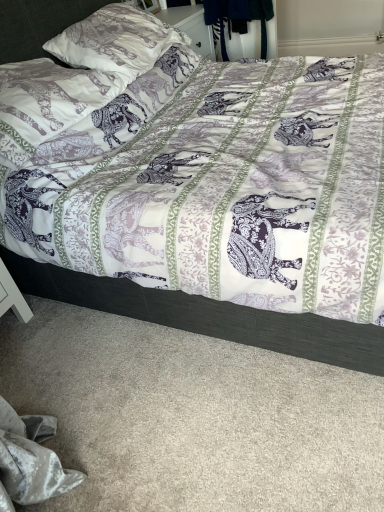
Question: In terms of size, does matte white pillow at upper left, which is counted as the 2th pillow, starting from the bottom, appear bigger or smaller than printed fabric pillow at upper left, placed as the first pillow when sorted from bottom to top?

Choices:
 (A) big
 (B) small

Answer: (A)

Question: From a real-world perspective, is matte white pillow at upper left, which is counted as the 2th pillow, starting from the bottom, physically located above or below printed fabric pillow at upper left, placed as the first pillow when sorted from bottom to top?

Choices:
 (A) above
 (B) below

Answer: (A)

Question: Which object is the farthest from the purple printed fabric bed at center?

Choices:
 (A) matte white pillow at upper left, which is counted as the 2th pillow, starting from the bottom
 (B) printed fabric pillow at upper left, placed as the first pillow when sorted from bottom to top

Answer: (A)

Question: Based on their relative distances, which object is farther from the printed fabric pillow at upper left, placed as the first pillow when sorted from bottom to top?

Choices:
 (A) matte white pillow at upper left, placed as the 1th pillow when sorted from top to bottom
 (B) purple printed fabric bed at center

Answer: (B)